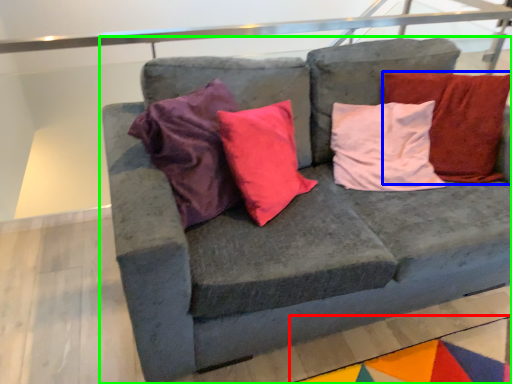
Question: Which object is positioned closest to mat (highlighted by a red box)? Select from pillow (highlighted by a blue box) and studio couch (highlighted by a green box).

Choices:
 (A) pillow
 (B) studio couch

Answer: (B)